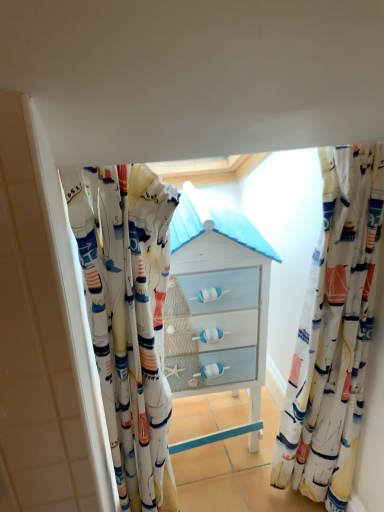
Question: Could white fabric curtain at center, marked as the 1th curtain in a left-to-right arrangement, be considered to be inside matte white chest of drawers at center?

Choices:
 (A) yes
 (B) no

Answer: (B)

Question: Considering the relative sizes of matte white chest of drawers at center and white fabric curtain at center, placed as the 2th curtain when sorted from right to left, in the image provided, is matte white chest of drawers at center wider than white fabric curtain at center, placed as the 2th curtain when sorted from right to left,?

Choices:
 (A) no
 (B) yes

Answer: (B)

Question: Does matte white chest of drawers at center have a lesser width compared to white fabric curtain at center, marked as the 1th curtain in a left-to-right arrangement?

Choices:
 (A) no
 (B) yes

Answer: (A)

Question: From a real-world perspective, is matte white chest of drawers at center beneath white fabric curtain at center, placed as the 2th curtain when sorted from right to left?

Choices:
 (A) no
 (B) yes

Answer: (B)

Question: Is matte white chest of drawers at center oriented away from white fabric curtain at center, marked as the 1th curtain in a left-to-right arrangement?

Choices:
 (A) yes
 (B) no

Answer: (B)

Question: From a real-world perspective, is matte white chest of drawers at center on top of white fabric curtain at center, placed as the 2th curtain when sorted from right to left?

Choices:
 (A) no
 (B) yes

Answer: (A)

Question: Can you confirm if matte white chest of drawers at center is taller than sailboat-patterned fabric at right, which ranks as the second curtain in left-to-right order?

Choices:
 (A) no
 (B) yes

Answer: (A)

Question: Is matte white chest of drawers at center to the right of sailboat-patterned fabric at right, which appears as the 1th curtain when viewed from the right, from the viewer's perspective?

Choices:
 (A) yes
 (B) no

Answer: (B)

Question: From a real-world perspective, is matte white chest of drawers at center physically above sailboat-patterned fabric at right, which ranks as the second curtain in left-to-right order?

Choices:
 (A) yes
 (B) no

Answer: (B)

Question: From the image's perspective, does matte white chest of drawers at center appear lower than sailboat-patterned fabric at right, which ranks as the second curtain in left-to-right order?

Choices:
 (A) no
 (B) yes

Answer: (A)

Question: Can you confirm if matte white chest of drawers at center is shorter than sailboat-patterned fabric at right, which appears as the 1th curtain when viewed from the right?

Choices:
 (A) yes
 (B) no

Answer: (A)

Question: Does matte white chest of drawers at center touch sailboat-patterned fabric at right, which appears as the 1th curtain when viewed from the right?

Choices:
 (A) no
 (B) yes

Answer: (A)

Question: From the image's perspective, does white fabric curtain at center, marked as the 1th curtain in a left-to-right arrangement, appear higher than matte white chest of drawers at center?

Choices:
 (A) no
 (B) yes

Answer: (A)